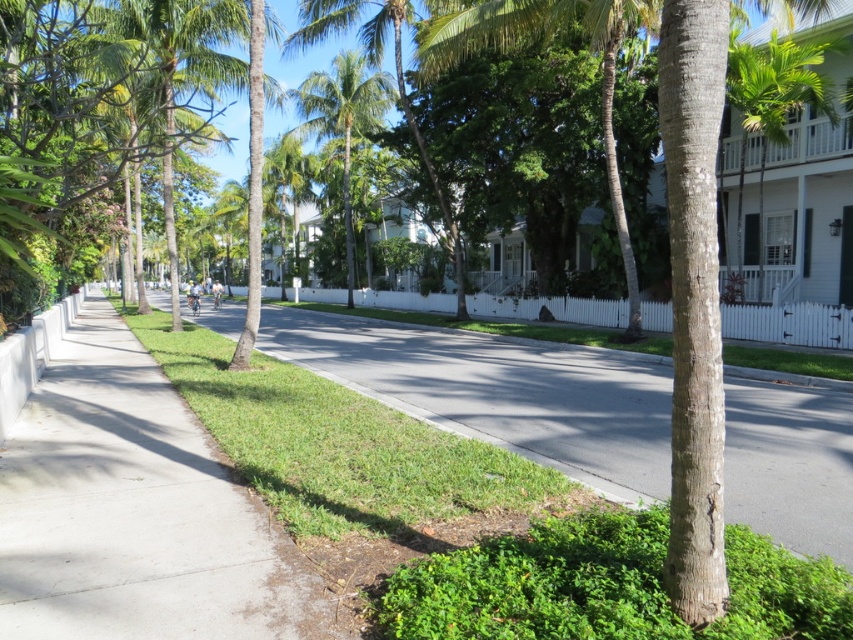
Question: Which of the following is the closest to the observer?

Choices:
 (A) (344, 61)
 (B) (146, 378)
 (C) (776, 115)

Answer: (B)

Question: Is gray concrete sidewalk at center smaller than green leafy palm tree at center?

Choices:
 (A) no
 (B) yes

Answer: (B)

Question: Can you confirm if gray concrete sidewalk at center is positioned above green leafy palm tree at upper right?

Choices:
 (A) yes
 (B) no

Answer: (B)

Question: Which point is closer to the camera taking this photo?

Choices:
 (A) (91, 394)
 (B) (465, 369)
 (C) (347, 268)
 (D) (810, 90)

Answer: (A)

Question: Can you confirm if gray concrete sidewalk at center is thinner than green leafy palm tree at center?

Choices:
 (A) no
 (B) yes

Answer: (A)

Question: Which of these objects is positioned farthest from the green grass at lower left?

Choices:
 (A) green leafy palm tree at center
 (B) gray concrete sidewalk at center
 (C) green leafy palm tree at upper right

Answer: (A)